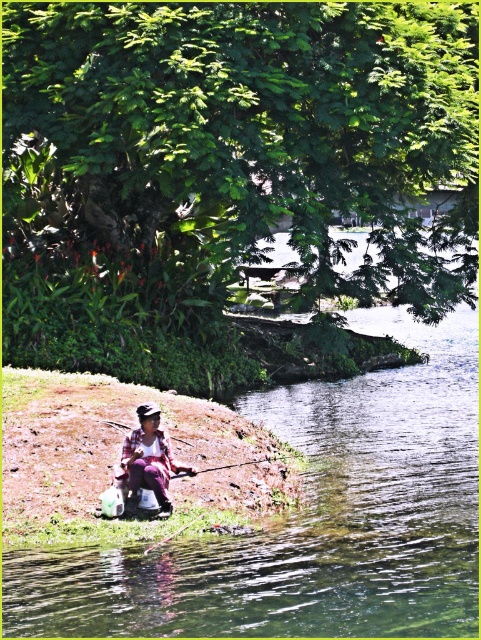
Question: Which point is closer to the camera?

Choices:
 (A) clear water at river right
 (B) purple fabric at lower left

Answer: (A)

Question: Can you confirm if clear water at river right is wider than purple fabric at lower left?

Choices:
 (A) no
 (B) yes

Answer: (B)

Question: From the image, what is the correct spatial relationship of clear water at river right in relation to purple fabric at lower left?

Choices:
 (A) below
 (B) above

Answer: (B)

Question: Is clear water at river right closer to the viewer compared to purple fabric at lower left?

Choices:
 (A) yes
 (B) no

Answer: (A)